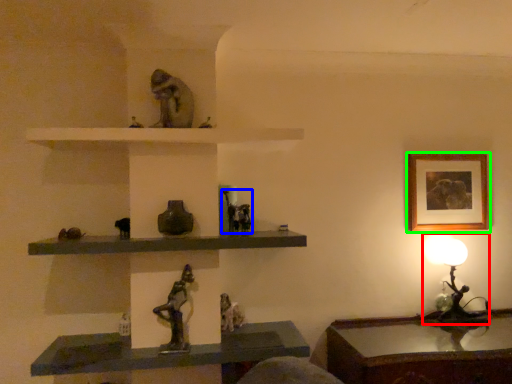
Question: Based on their relative distances, which object is nearer to table lamp (highlighted by a red box)? Choose from animal (highlighted by a blue box) and picture frame (highlighted by a green box).

Choices:
 (A) animal
 (B) picture frame

Answer: (B)